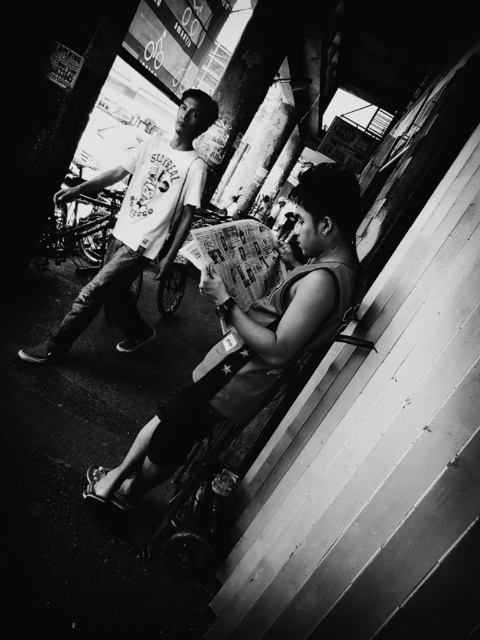
Question: Which object appears farthest from the camera in this image?

Choices:
 (A) wooden stair at lower right
 (B) matte white t-shirt at center
 (C) smooth paper newspaper at center

Answer: (B)

Question: Which object appears farthest from the camera in this image?

Choices:
 (A) matte white t-shirt at center
 (B) smooth paper newspaper at center
 (C) wooden stair at lower right

Answer: (A)

Question: Can you confirm if wooden stair at lower right is positioned to the left of matte white t-shirt at center?

Choices:
 (A) yes
 (B) no

Answer: (B)

Question: Observing the image, what is the correct spatial positioning of smooth paper newspaper at center in reference to matte white t-shirt at center?

Choices:
 (A) below
 (B) above

Answer: (A)

Question: Is wooden stair at lower right to the left of smooth paper newspaper at center from the viewer's perspective?

Choices:
 (A) no
 (B) yes

Answer: (A)

Question: Which of the following is the closest to the observer?

Choices:
 (A) matte white t-shirt at center
 (B) wooden stair at lower right
 (C) smooth paper newspaper at center

Answer: (B)